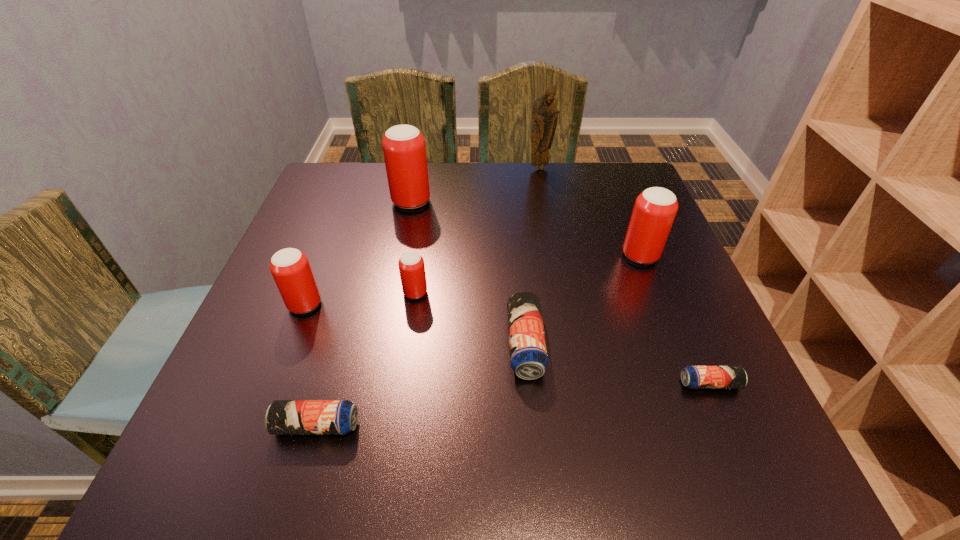
Where is `the biggest blue beer can`? This screenshot has height=540, width=960. the biggest blue beer can is located at coordinates (528, 355).

Where is `the fifth tallest beer can`? This screenshot has width=960, height=540. the fifth tallest beer can is located at coordinates click(x=528, y=355).

Find the location of `the nearest beer can`. the nearest beer can is located at coordinates (283, 417).

Identify the location of the nearest blue beer can. This screenshot has width=960, height=540. (283, 417).

This screenshot has width=960, height=540. I want to click on the rightmost blue beer can, so [694, 377].

Find the location of `the smallest blue beer can`. the smallest blue beer can is located at coordinates tap(694, 377).

I want to click on free spot located 0.110m on the front-facing side of the sixth object from left to right, so click(544, 192).

The height and width of the screenshot is (540, 960). I want to click on vacant space located on the right of the seventh shortest object, so click(468, 202).

Find the location of `free region located on the left of the rightmost red beer can`. free region located on the left of the rightmost red beer can is located at coordinates (504, 256).

Where is `free point located on the front of the fifth shortest object`? free point located on the front of the fifth shortest object is located at coordinates (286, 354).